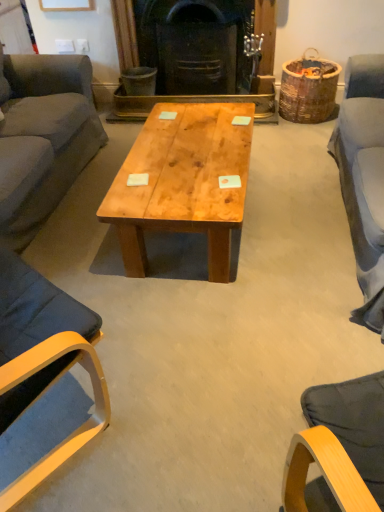
Where is `vacant area located to the right-hand side of matte wood chair at left`? This screenshot has width=384, height=512. vacant area located to the right-hand side of matte wood chair at left is located at coordinates (170, 386).